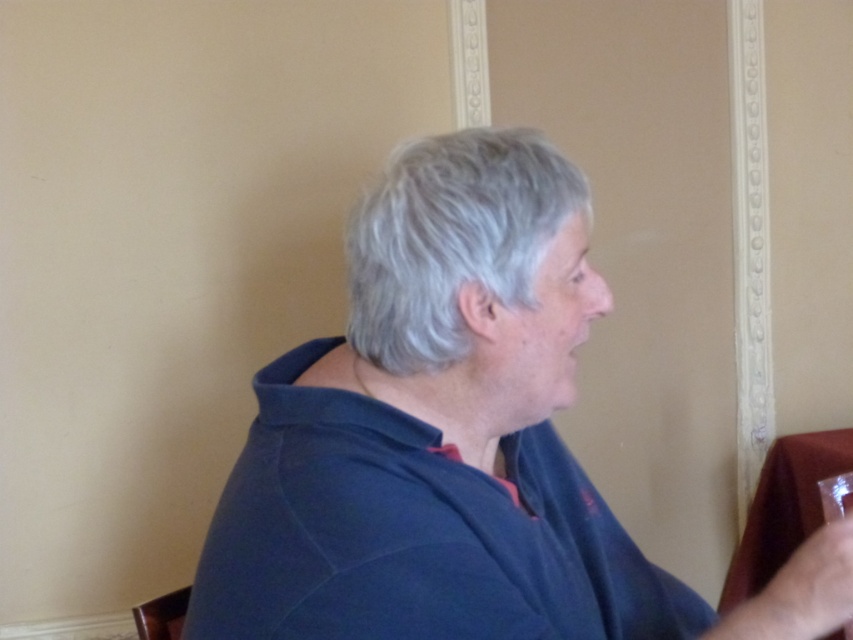
Question: Does dark blue shirt at center have a greater width compared to clear glass wine glass at right?

Choices:
 (A) no
 (B) yes

Answer: (B)

Question: Among these points, which one is nearest to the camera?

Choices:
 (A) (546, 282)
 (B) (834, 492)

Answer: (A)

Question: Can you confirm if dark blue shirt at center is bigger than clear glass wine glass at right?

Choices:
 (A) yes
 (B) no

Answer: (A)

Question: Where is dark blue shirt at center located in relation to clear glass wine glass at right in the image?

Choices:
 (A) above
 (B) below

Answer: (A)

Question: Which point is farther to the camera?

Choices:
 (A) (538, 179)
 (B) (848, 513)

Answer: (B)